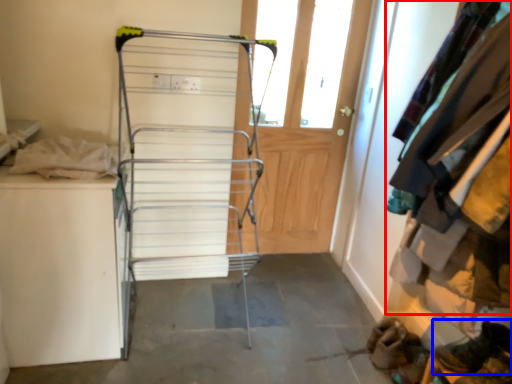
Question: Among these objects, which one is farthest to the camera, clothing (highlighted by a red box) or footwear (highlighted by a blue box)?

Choices:
 (A) clothing
 (B) footwear

Answer: (B)